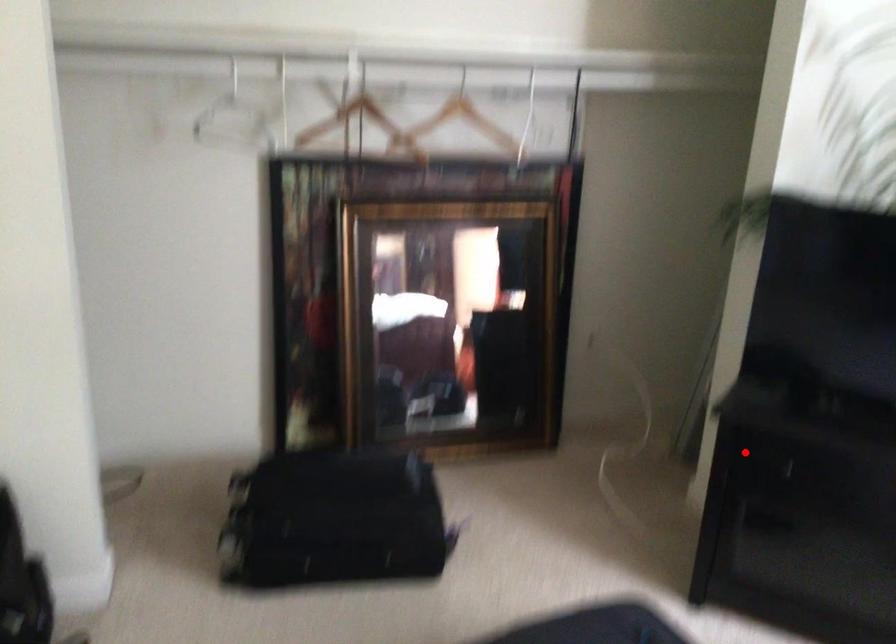
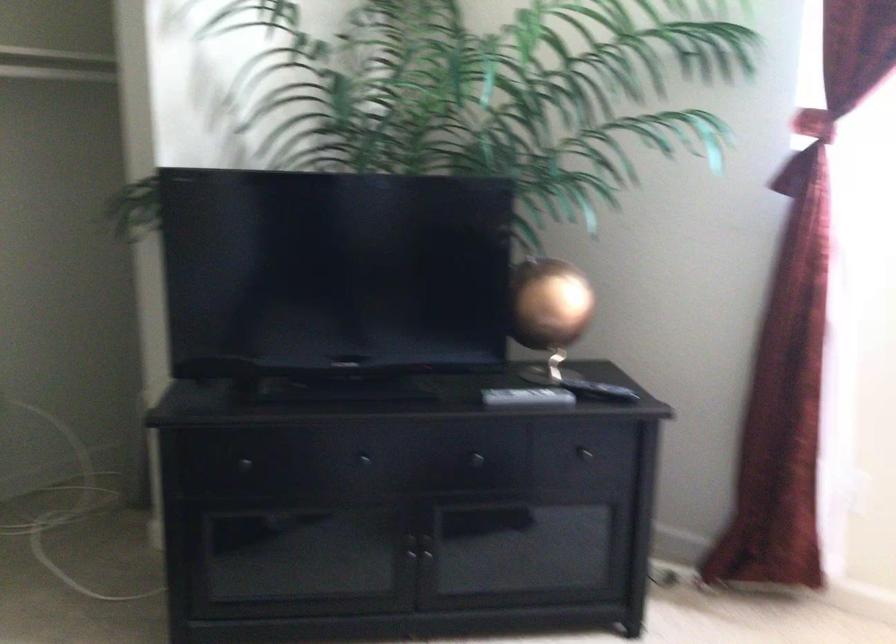
Where in the second image is the point corresponding to the highlighted location from the first image?

(239, 464)